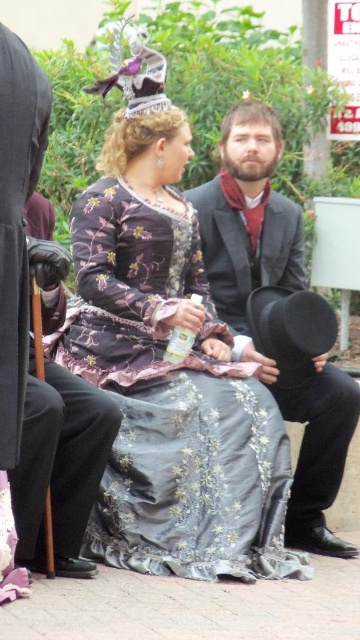
Does point (171, 461) come closer to viewer compared to point (297, 228)?

Yes.

Does silky purple dress at center appear on the right side of matte black suit at center?

In fact, silky purple dress at center is to the left of matte black suit at center.

Image resolution: width=360 pixels, height=640 pixels. What do you see at coordinates (172, 404) in the screenshot?
I see `silky purple dress at center` at bounding box center [172, 404].

Where is `silky purple dress at center`? silky purple dress at center is located at coordinates (172, 404).